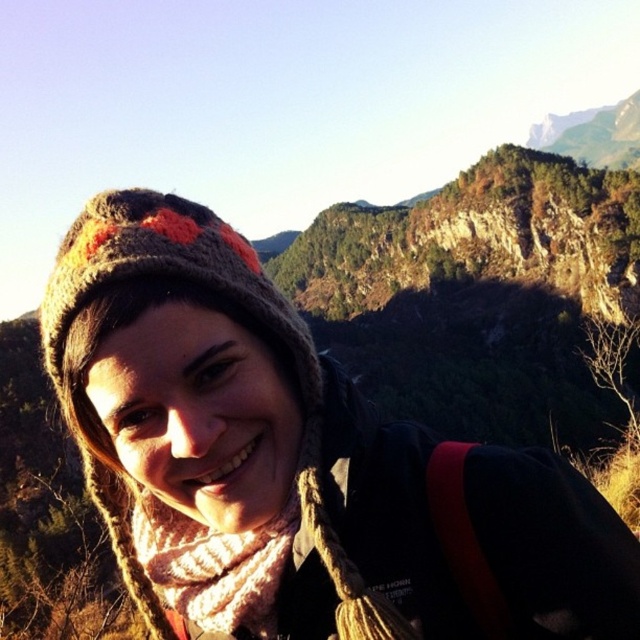
You are a photographer trying to capture the perfect shot of the knitted woolen hat at upper left. If your camera has a maximum focus range of 10 meters, will you be able to clearly capture the hat in your photo?

The knitted woolen hat at upper left and camera are 11.26 meters apart, which exceeds the camera maximum focus range of 10 meters. Therefore, the camera cannot clearly capture the hat in the photo.

You are a photographer trying to capture the perfect shot of the person in the scene. You want to focus on the knitted woolen hat at upper left and the knitted beige scarf at lower center. Which object is positioned higher in the frame?

The knitted woolen hat at upper left is positioned higher in the frame than the knitted beige scarf at lower center.

You are a photographer trying to capture a closeup of the knitted woolen hat at upper left and the knitted beige scarf at lower center. Given that your camera can focus on objects within a 10 feet range, will both items be in focus?

The knitted woolen hat at upper left is 10.70 feet away from the knitted beige scarf at lower center. Since the camera can only focus within 10 feet, the distance between them exceeds the focus range, so they won